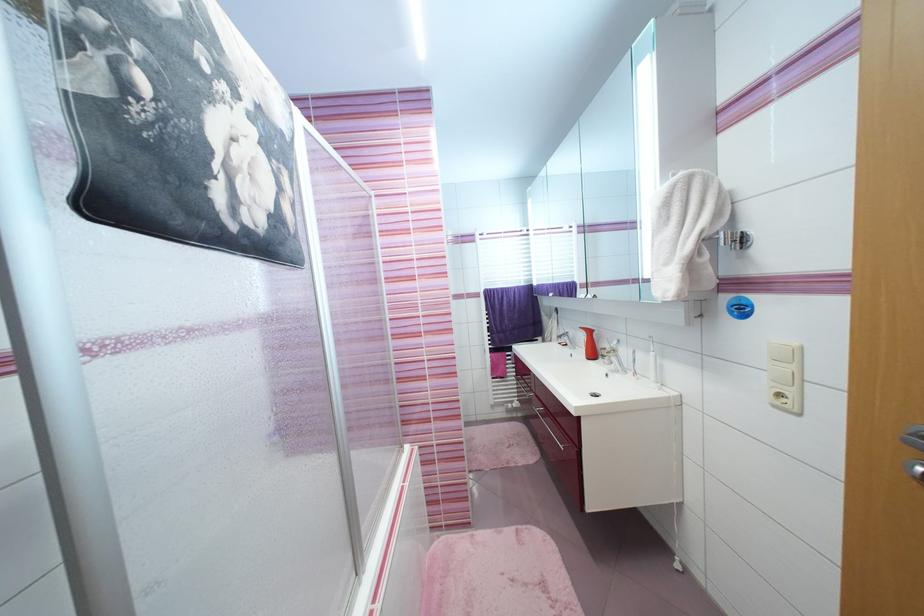
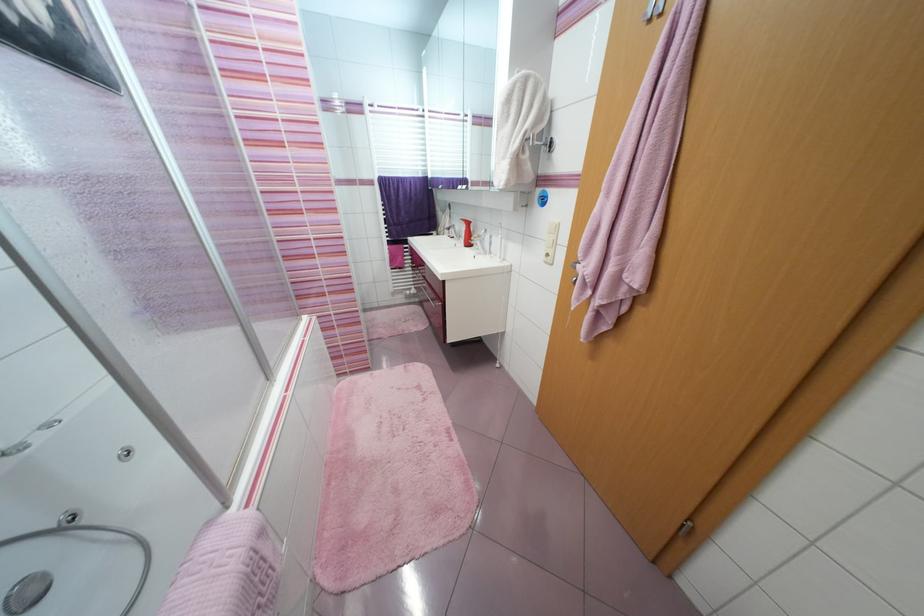
In the second image, find the point that corresponds to pixel 711 241 in the first image.

(530, 140)